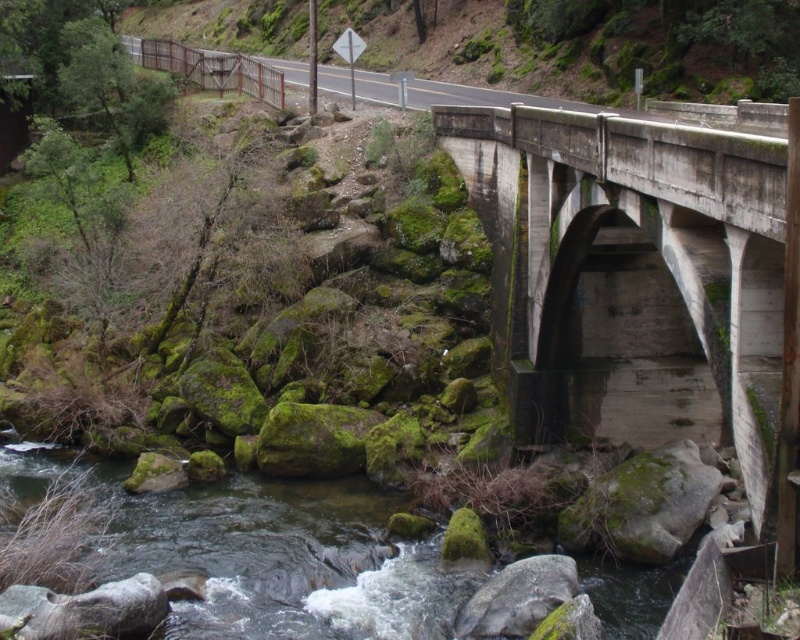
You are a hiker standing on the bridge and want to reach the green mossy rocks at lower center. Which direction should you go relative to the green mossy rocks at upper left?

You should go downward from the green mossy rocks at upper left to reach the green mossy rocks at lower center since the green mossy rocks at lower center is below green mossy rocks at upper left.

You are standing on the wooden fence on the left embankment and want to reach the mossy rocks below. There is a point marked at coordinates (644, 278). What is the material at that point?

The point at coordinates (644, 278) is on concrete at center, so the material there is concrete.